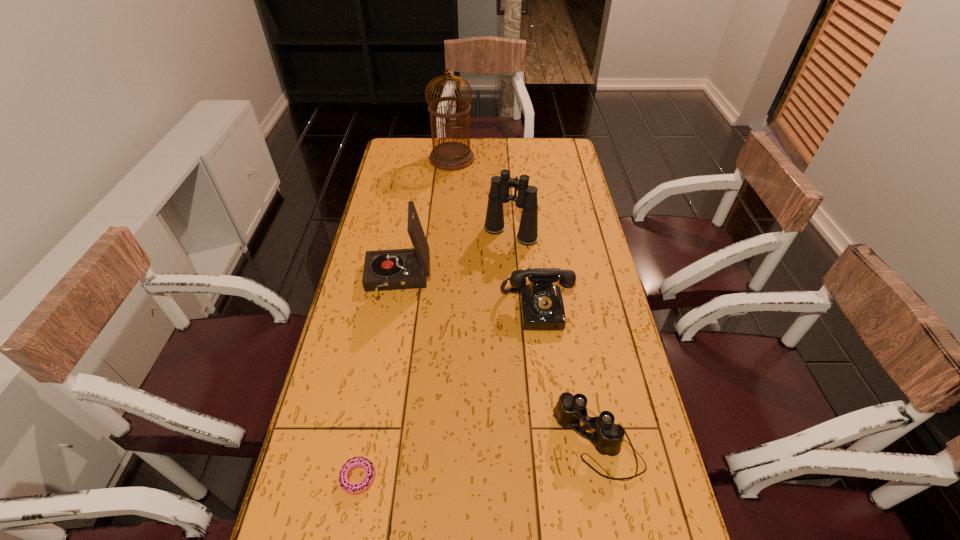
Where is `the farthest object`? This screenshot has height=540, width=960. the farthest object is located at coordinates (450, 156).

In order to click on the tallest object in this screenshot , I will do `click(450, 156)`.

In order to click on the fifth nearest object in this screenshot , I will do `click(527, 234)`.

Image resolution: width=960 pixels, height=540 pixels. What are the coordinates of `the taller binoculars` in the screenshot? It's located at (527, 234).

Where is `phonograph record`? phonograph record is located at coordinates (396, 269).

Find the location of a particular element. the fourth tallest object is located at coordinates (542, 308).

This screenshot has height=540, width=960. What are the coordinates of `the shorter binoculars` in the screenshot? It's located at (607, 437).

Identify the location of the nearer binoculars. The height and width of the screenshot is (540, 960). [x=607, y=437].

What are the coordinates of `doughnut` in the screenshot? It's located at (351, 488).

I want to click on free space located 0.210m on the front-facing side of the tallest object, so click(520, 159).